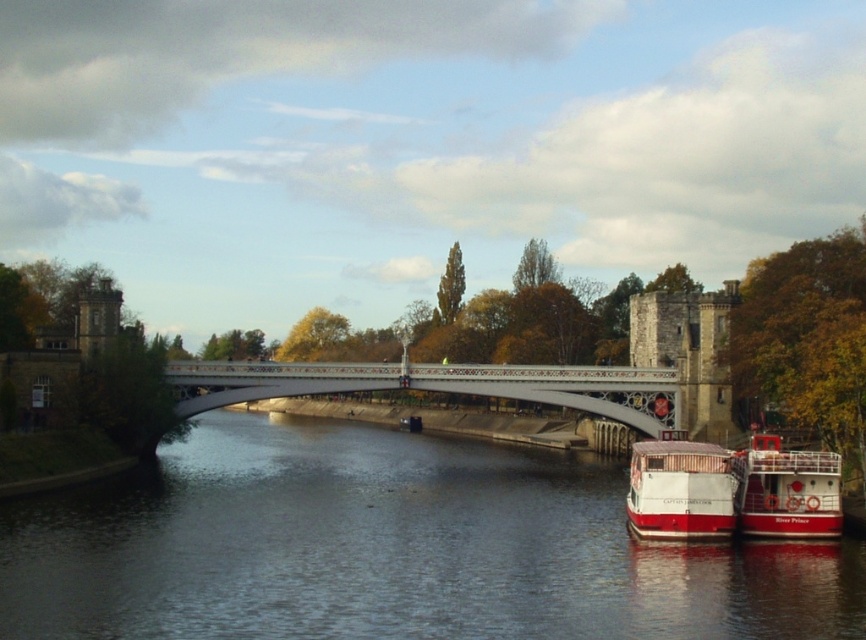
Consider the image. You are a tourist standing on the white bridge and want to take a photo of the red matte boat at lower right and the dark blue water at center. Which object should you focus on first if you want to capture both in your shot?

You should focus on the dark blue water at center first because it is to the left of the red matte boat at lower right, allowing you to frame both in your shot.

You are planning to cross the river using a small raft that is 2 meters wide. The raft must fit entirely within the dark blue water at center. Based on the scene, can the raft be safely placed there without touching the red matte boat at lower right?

The dark blue water at center has a width larger than the red matte boat at lower right, so the raft can be safely placed there as there is enough space between them.